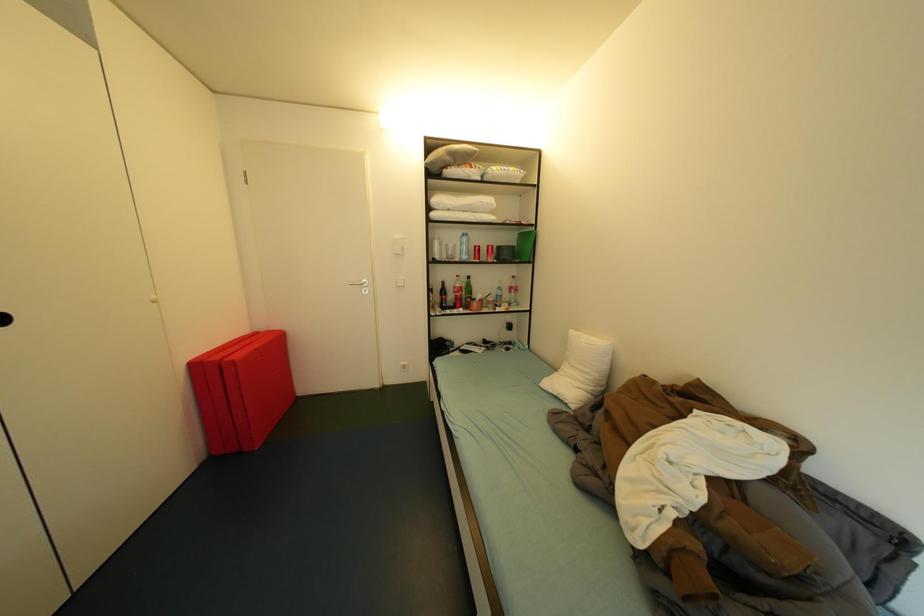
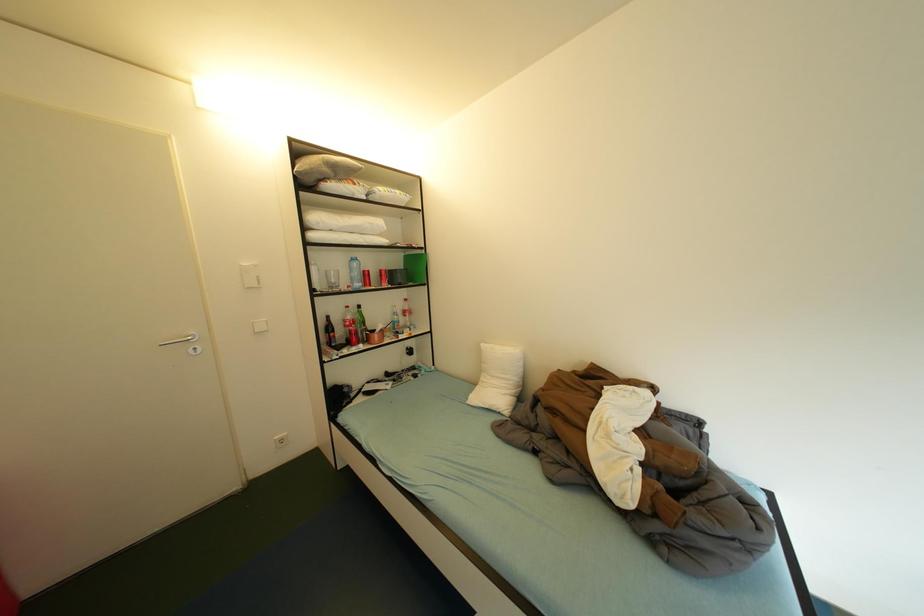
Question: The images are taken continuously from a first-person perspective. In which direction is your viewpoint rotating?

Choices:
 (A) Left
 (B) Right
 (C) Up
 (D) Down

Answer: (B)